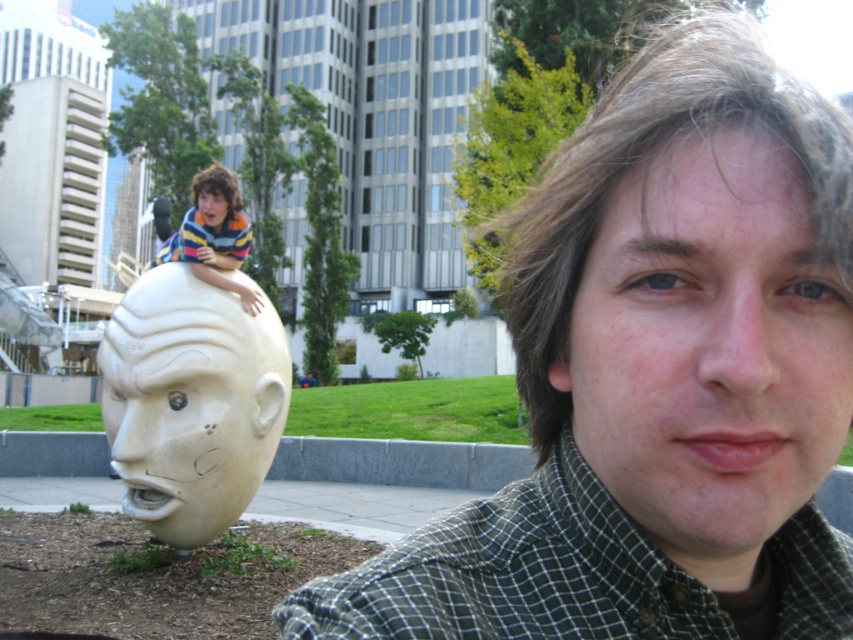
Question: Where is green checkered shirt at lower right located in relation to white matte sculpture at left in the image?

Choices:
 (A) above
 (B) below

Answer: (A)

Question: Does striped sweater at left have a greater width compared to matte yellow head at left?

Choices:
 (A) no
 (B) yes

Answer: (B)

Question: Among these objects, which one is farthest from the camera?

Choices:
 (A) matte white head at left
 (B) green checkered shirt at lower right
 (C) white matte sculpture at left

Answer: (C)

Question: Which object is closer to the camera taking this photo?

Choices:
 (A) matte white head at left
 (B) white matte sculpture at left
 (C) white stone head at center

Answer: (A)

Question: Among these points, which one is nearest to the camera?

Choices:
 (A) (769, 179)
 (B) (399, 573)
 (C) (183, 301)
 (D) (213, 211)

Answer: (A)

Question: Can you confirm if green checkered shirt at lower right is positioned above white stone head at center?

Choices:
 (A) no
 (B) yes

Answer: (A)